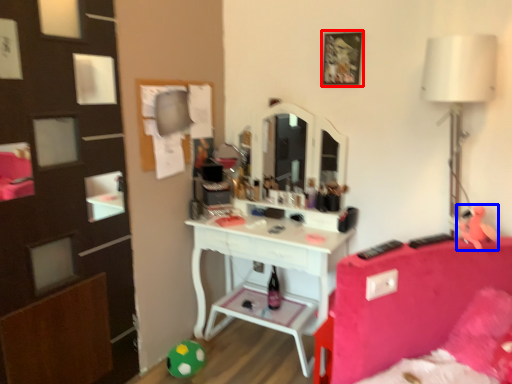
Question: Which object appears closest to the camera in this image, picture frame (highlighted by a red box) or toy (highlighted by a blue box)?

Choices:
 (A) picture frame
 (B) toy

Answer: (B)